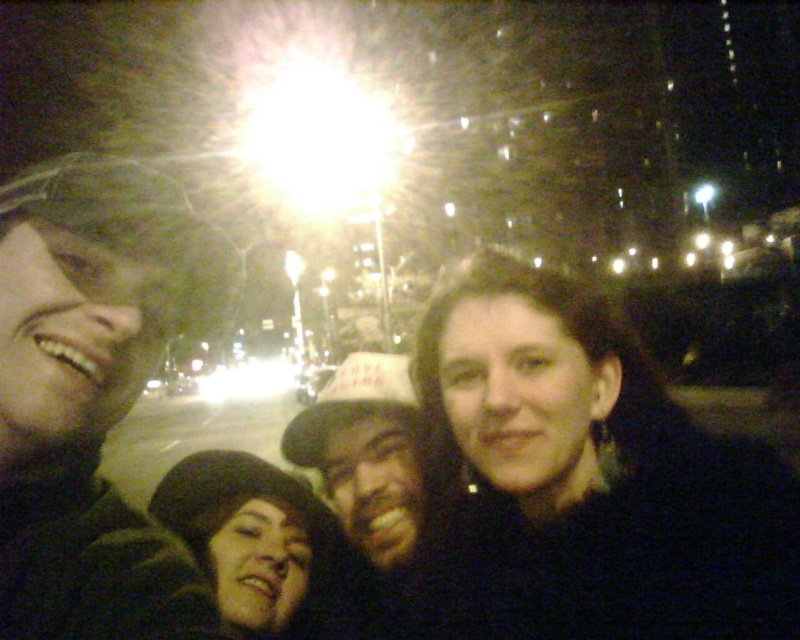
Is dark brown hair at center thinner than dark brown fur hat at lower left?

Correct, dark brown hair at center's width is less than dark brown fur hat at lower left's.

Is point (670, 400) in front of point (214, 449)?

Yes, point (670, 400) is closer to viewer.

Image resolution: width=800 pixels, height=640 pixels. I want to click on dark brown hair at center, so click(588, 480).

Does dark brown hair at center appear on the left side of dark brown hair at left?

Incorrect, dark brown hair at center is not on the left side of dark brown hair at left.

Measure the distance between dark brown hair at center and camera.

dark brown hair at center is 35.48 inches from camera.

This screenshot has height=640, width=800. I want to click on dark brown hair at center, so click(x=588, y=480).

Is point (104, 413) behind point (409, 397)?

No, it is in front of (409, 397).

Based on the photo, is dark brown hair at left closer to the viewer compared to dark brown leather hat at center?

Yes, dark brown hair at left is in front of dark brown leather hat at center.

You are a GUI agent. You are given a task and a screenshot of the screen. Output one action in this format:
    pyautogui.click(x=<x>, y=<y>)
    Task: Click on the dark brown hair at left
    This screenshot has height=640, width=800.
    Given the screenshot: What is the action you would take?
    pyautogui.click(x=92, y=396)

The image size is (800, 640). I want to click on dark brown hair at left, so click(92, 396).